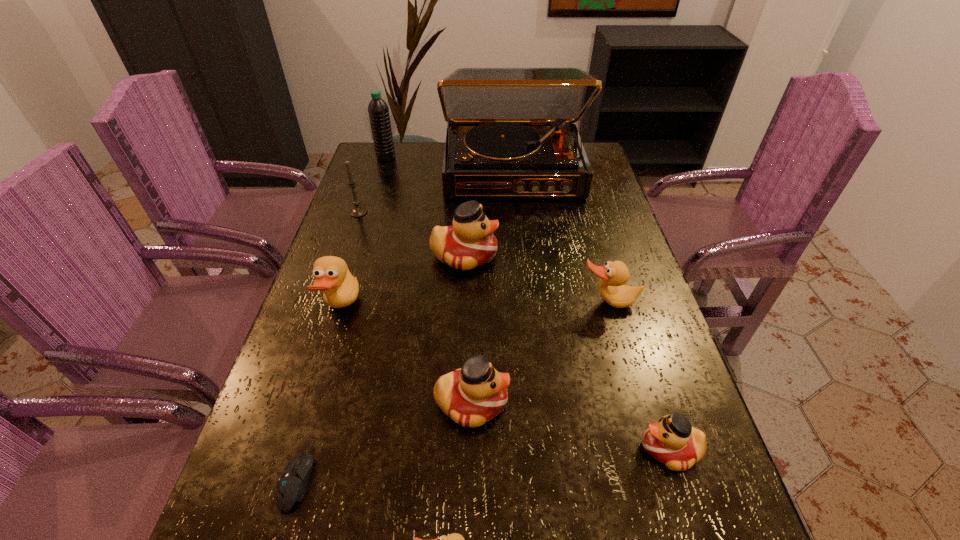
Where is `free space between the third farthest object and the biggest tan duck`? The width and height of the screenshot is (960, 540). free space between the third farthest object and the biggest tan duck is located at coordinates (350, 260).

At what (x,y) coordinates should I click in order to perform the action: click on blank region between the second biggest red duck and the record player. Please return your answer as a coordinate pair (x, y). The width and height of the screenshot is (960, 540). Looking at the image, I should click on (492, 287).

This screenshot has width=960, height=540. Find the location of `free space between the shortest object and the biggest tan duck`. free space between the shortest object and the biggest tan duck is located at coordinates pyautogui.click(x=320, y=393).

Find the location of a particular element. vacant area between the eighth nearest object and the black water bottle is located at coordinates (372, 185).

At what (x,y) coordinates should I click in order to perform the action: click on free space between the candle and the leftmost duck. Please return your answer as a coordinate pair (x, y). Looking at the image, I should click on (350, 260).

Where is `vacant area that lies between the biggest tan duck and the computer mouse`? This screenshot has width=960, height=540. vacant area that lies between the biggest tan duck and the computer mouse is located at coordinates click(320, 393).

The image size is (960, 540). Find the location of `the eighth closest object to the candle`. the eighth closest object to the candle is located at coordinates (454, 539).

I want to click on object that is the fourth nearest to the water bottle, so click(x=340, y=288).

Locate an element on the screen. duck that stands as the closest to the second biggest tan duck is located at coordinates (469, 243).

Locate an element on the screen. The width and height of the screenshot is (960, 540). duck that is the nearest to the rightmost tan duck is located at coordinates (469, 243).